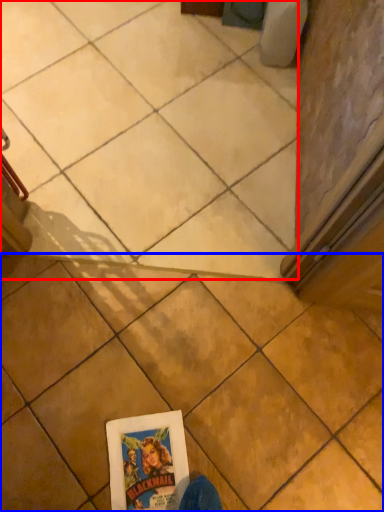
Question: Among these objects, which one is nearest to the camera, tile (highlighted by a red box) or tile (highlighted by a blue box)?

Choices:
 (A) tile
 (B) tile

Answer: (B)